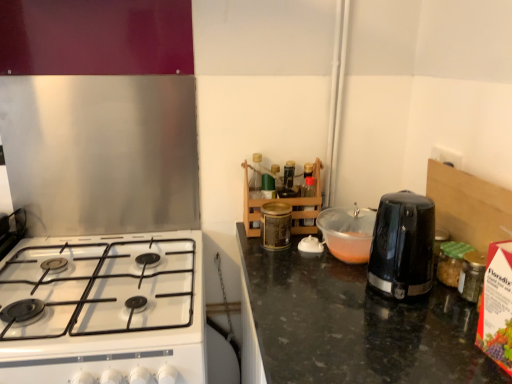
Question: Does black plastic toaster at center-right, which appears as the 2th kitchen appliance when viewed from the left, appear on the right side of black plastic kettle at right, arranged as the 1th kitchen appliance when viewed from the right?

Choices:
 (A) no
 (B) yes

Answer: (A)

Question: Considering the relative sizes of black plastic toaster at center-right, acting as the 2th kitchen appliance starting from the right, and black plastic kettle at right, arranged as the 1th kitchen appliance when viewed from the right, in the image provided, is black plastic toaster at center-right, acting as the 2th kitchen appliance starting from the right, bigger than black plastic kettle at right, arranged as the 1th kitchen appliance when viewed from the right,?

Choices:
 (A) no
 (B) yes

Answer: (A)

Question: Can you confirm if black plastic toaster at center-right, acting as the 2th kitchen appliance starting from the right, is thinner than black plastic kettle at right, arranged as the 1th kitchen appliance when viewed from the right?

Choices:
 (A) yes
 (B) no

Answer: (B)

Question: Is black plastic toaster at center-right, which appears as the 2th kitchen appliance when viewed from the left, further to the viewer compared to black plastic kettle at right, which appears as the 3th kitchen appliance when viewed from the left?

Choices:
 (A) no
 (B) yes

Answer: (B)

Question: Considering the relative sizes of black plastic toaster at center-right, which appears as the 2th kitchen appliance when viewed from the left, and black plastic kettle at right, arranged as the 1th kitchen appliance when viewed from the right, in the image provided, is black plastic toaster at center-right, which appears as the 2th kitchen appliance when viewed from the left, smaller than black plastic kettle at right, arranged as the 1th kitchen appliance when viewed from the right,?

Choices:
 (A) yes
 (B) no

Answer: (A)

Question: Is black plastic toaster at center-right, acting as the 2th kitchen appliance starting from the right, to the left of black plastic kettle at right, which appears as the 3th kitchen appliance when viewed from the left, from the viewer's perspective?

Choices:
 (A) no
 (B) yes

Answer: (B)

Question: Is gold metallic canister at center, which ranks as the 3th kitchen appliance in right-to-left order, bigger than black plastic kettle at right, which appears as the 3th kitchen appliance when viewed from the left?

Choices:
 (A) yes
 (B) no

Answer: (B)

Question: From the image's perspective, would you say gold metallic canister at center, which appears as the 1th kitchen appliance when viewed from the left, is positioned over black plastic kettle at right, which appears as the 3th kitchen appliance when viewed from the left?

Choices:
 (A) yes
 (B) no

Answer: (A)

Question: Is gold metallic canister at center, which appears as the 1th kitchen appliance when viewed from the left, facing away from black plastic kettle at right, which appears as the 3th kitchen appliance when viewed from the left?

Choices:
 (A) yes
 (B) no

Answer: (B)

Question: Considering the relative sizes of gold metallic canister at center, which appears as the 1th kitchen appliance when viewed from the left, and black plastic kettle at right, which appears as the 3th kitchen appliance when viewed from the left, in the image provided, is gold metallic canister at center, which appears as the 1th kitchen appliance when viewed from the left, taller than black plastic kettle at right, which appears as the 3th kitchen appliance when viewed from the left,?

Choices:
 (A) no
 (B) yes

Answer: (A)

Question: Is gold metallic canister at center, which ranks as the 3th kitchen appliance in right-to-left order, smaller than black plastic kettle at right, arranged as the 1th kitchen appliance when viewed from the right?

Choices:
 (A) yes
 (B) no

Answer: (A)

Question: Is the depth of gold metallic canister at center, which appears as the 1th kitchen appliance when viewed from the left, less than that of black plastic kettle at right, which appears as the 3th kitchen appliance when viewed from the left?

Choices:
 (A) yes
 (B) no

Answer: (B)

Question: Does black plastic toaster at center-right, acting as the 2th kitchen appliance starting from the right, appear on the right side of gold metallic canister at center, which appears as the 1th kitchen appliance when viewed from the left?

Choices:
 (A) no
 (B) yes

Answer: (B)